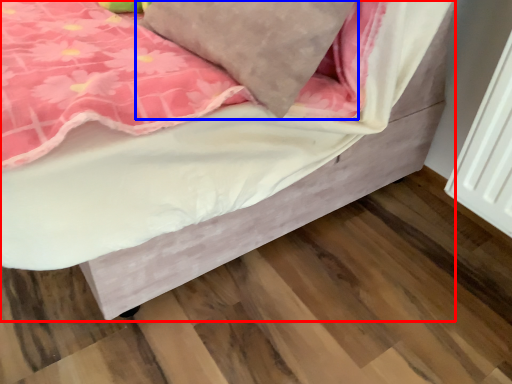
Question: Which of the following is the closest to the observer, bed (highlighted by a red box) or pillow (highlighted by a blue box)?

Choices:
 (A) bed
 (B) pillow

Answer: (A)